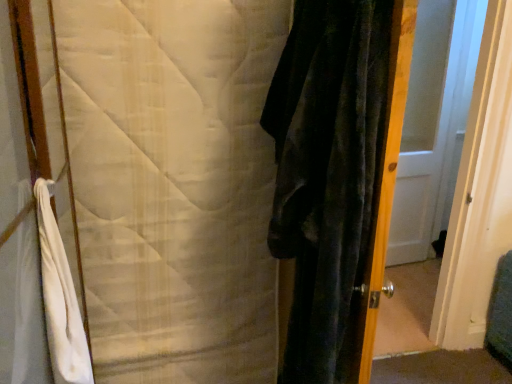
Question: From a real-world perspective, is velvet dark green screen door at right below white quilted blanket at left?

Choices:
 (A) no
 (B) yes

Answer: (A)

Question: Considering the relative sizes of velvet dark green screen door at right and white quilted blanket at left in the image provided, is velvet dark green screen door at right wider than white quilted blanket at left?

Choices:
 (A) yes
 (B) no

Answer: (A)

Question: Is white quilted blanket at left completely or partially inside velvet dark green screen door at right?

Choices:
 (A) no
 (B) yes

Answer: (A)

Question: Is velvet dark green screen door at right next to white quilted blanket at left and touching it?

Choices:
 (A) no
 (B) yes

Answer: (A)

Question: Is velvet dark green screen door at right thinner than white quilted blanket at left?

Choices:
 (A) no
 (B) yes

Answer: (A)

Question: Based on their sizes in the image, would you say white quilted blanket at left is bigger or smaller than white glossy door at center?

Choices:
 (A) big
 (B) small

Answer: (A)

Question: From the image's perspective, is white quilted blanket at left located above or below white glossy door at center?

Choices:
 (A) above
 (B) below

Answer: (B)

Question: Looking at their shapes, would you say white quilted blanket at left is wider or thinner than white glossy door at center?

Choices:
 (A) wide
 (B) thin

Answer: (A)

Question: Which is correct: white quilted blanket at left is inside white glossy door at center, or outside of it?

Choices:
 (A) inside
 (B) outside

Answer: (B)

Question: Which is correct: white quilted blanket at left is inside white cotton bath towel at left, or outside of it?

Choices:
 (A) outside
 (B) inside

Answer: (A)

Question: In terms of width, does white quilted blanket at left look wider or thinner when compared to white cotton bath towel at left?

Choices:
 (A) wide
 (B) thin

Answer: (B)

Question: Is white quilted blanket at left bigger or smaller than white cotton bath towel at left?

Choices:
 (A) big
 (B) small

Answer: (A)

Question: Considering the positions of point (126, 124) and point (65, 314), is point (126, 124) closer or farther from the camera than point (65, 314)?

Choices:
 (A) farther
 (B) closer

Answer: (A)

Question: Is point (445, 16) positioned closer to the camera than point (241, 160)?

Choices:
 (A) farther
 (B) closer

Answer: (A)

Question: From the image's perspective, relative to white quilted blanket at left, is white glossy door at center above or below?

Choices:
 (A) below
 (B) above

Answer: (B)